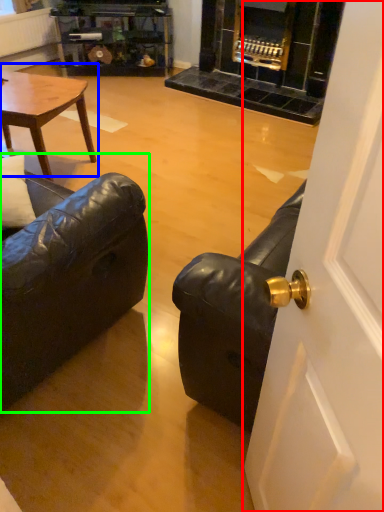
Question: Based on their relative distances, which object is nearer to door (highlighted by a red box)? Choose from coffee table (highlighted by a blue box) and studio couch (highlighted by a green box).

Choices:
 (A) coffee table
 (B) studio couch

Answer: (B)